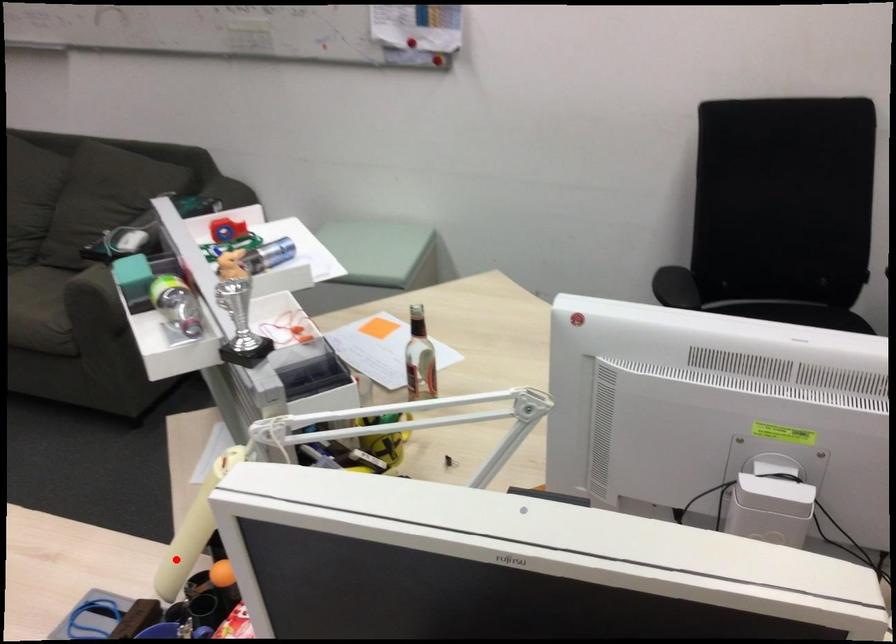
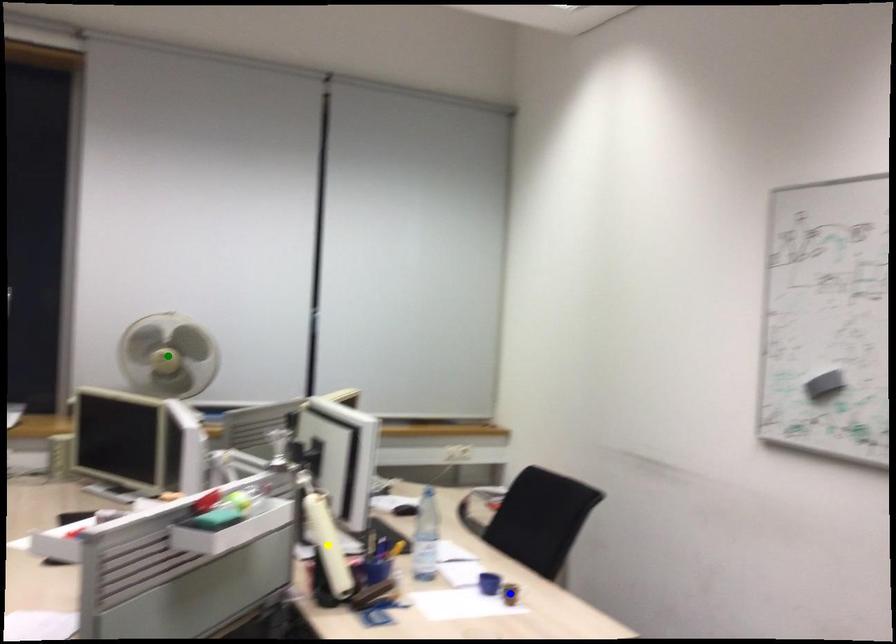
Question: I am providing you with two images of the same scene from different viewpoints. A red point is marked on the first image. You are given multiple points on the second image. Can you choose the point in image 2 that corresponds to the point in image 1?

Choices:
 (A) green point
 (B) yellow point
 (C) blue point

Answer: (B)